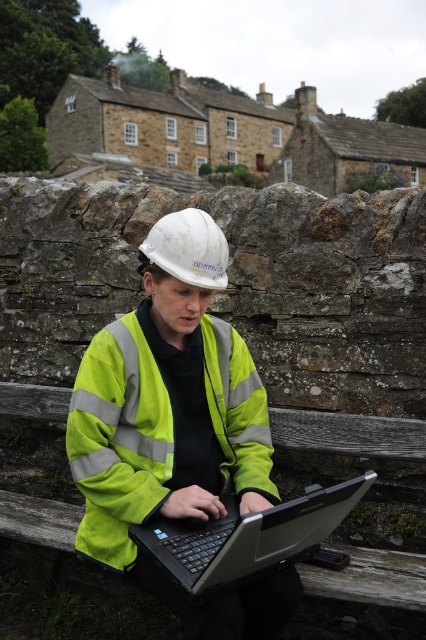
You are a delivery person trying to deliver a package to the person sitting on the wooden bench. The package is too large to place on the bench, so you need to hand it to them directly. Considering their current position with the neon yellow reflective vest at center and the black plastic laptop at center, can you hand them the package without disturbing the laptop?

The black plastic laptop at center is behind the neon yellow reflective vest at center, so handing the package to the person while avoiding the laptop might be possible by approaching from the front where the laptop is not obstructed.

You are a safety inspector in a construction site. You see a neon yellow reflective vest at center and a camera. Your task is to ensure that the distance between the vest and the camera is at least 5 feet for clear visibility. Is the current distance sufficient?

The neon yellow reflective vest at center and camera are 6.20 feet apart, which is more than the required 5 feet, so the distance is sufficient for clear visibility.

You are a delivery person trying to deliver a package to the person sitting on the wooden bench. The package requires a signature, and you need to ensure the person can easily sign without moving their current items. Which item, the neon yellow reflective vest at center or the black plastic laptop at center, should you place the pen on to make signing easier?

The neon yellow reflective vest at center has a larger size compared to the black plastic laptop at center, so placing the pen on the neon yellow reflective vest at center would provide more space for the person to sign comfortably.